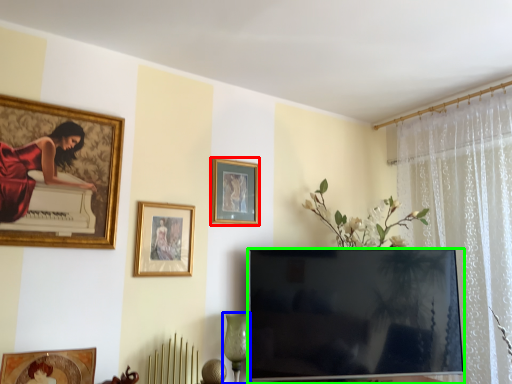
Question: Which object is positioned farthest from picture frame (highlighted by a red box)? Select from glass vase (highlighted by a blue box) and television (highlighted by a green box).

Choices:
 (A) glass vase
 (B) television

Answer: (A)